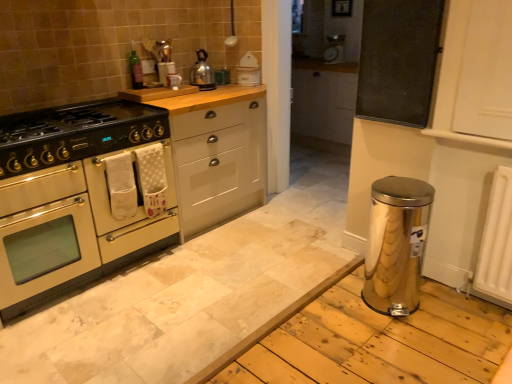
What is the approximate height of polished stainless steel kettle at upper center?

polished stainless steel kettle at upper center is 11.04 inches in height.

What are the coordinates of `white plastic toaster at upper center` in the screenshot? It's located at (248, 70).

I want to click on metallic mesh board at upper right, so click(398, 60).

The height and width of the screenshot is (384, 512). Describe the element at coordinates (214, 150) in the screenshot. I see `white matte cabinet at center, the 2th cabinetry in the left-to-right sequence` at that location.

This screenshot has width=512, height=384. Describe the element at coordinates (396, 244) in the screenshot. I see `stainless steel water heater at lower right` at that location.

Measure the distance between point (x=389, y=203) and camera.

The depth of point (x=389, y=203) is 1.99 meters.

Measure the distance between point (42, 113) and camera.

Point (42, 113) and camera are 8.22 feet apart from each other.

The width and height of the screenshot is (512, 384). What do you see at coordinates (85, 127) in the screenshot?
I see `matte black gas stove at left` at bounding box center [85, 127].

The image size is (512, 384). Find the location of `cream matte oven at left, the 1th cabinetry positioned from the left`. cream matte oven at left, the 1th cabinetry positioned from the left is located at coordinates (120, 184).

Where is `green glass bottle at upper center`? This screenshot has width=512, height=384. green glass bottle at upper center is located at coordinates (136, 70).

Identify the location of polished stainless steel kettle at upper center. This screenshot has width=512, height=384. (202, 73).

How many degrees apart are the facing directions of green glass bottle at upper center and white plastic toaster at upper center?

The facing directions of green glass bottle at upper center and white plastic toaster at upper center are 65.7 degrees apart.

Which object is more forward, green glass bottle at upper center or white plastic toaster at upper center?

Positioned in front is green glass bottle at upper center.

From a real-world perspective, which object stands above the other?

green glass bottle at upper center.

Could you tell me if polished stainless steel kettle at upper center is turned towards stainless steel water heater at lower right?

Yes.

The image size is (512, 384). Identify the location of kitchen appliance positioned vertically above the stainless steel water heater at lower right (from a real-world perspective). (202, 73).

From a real-world perspective, is polished stainless steel kettle at upper center positioned over stainless steel water heater at lower right based on gravity?

Yes, from a real-world perspective, polished stainless steel kettle at upper center is above stainless steel water heater at lower right.

Which object is closer to the camera, polished stainless steel kettle at upper center or stainless steel water heater at lower right?

stainless steel water heater at lower right is closer to the camera.

Could you tell me if metallic mesh board at upper right is facing stainless steel water heater at lower right?

No, metallic mesh board at upper right does not turn towards stainless steel water heater at lower right.

From a real-world perspective, is metallic mesh board at upper right on stainless steel water heater at lower right?

Yes, from a real-world perspective, metallic mesh board at upper right is on top of stainless steel water heater at lower right.

Is metallic mesh board at upper right spatially inside stainless steel water heater at lower right, or outside of it?

metallic mesh board at upper right lies outside stainless steel water heater at lower right.

Are white matte cabinet at center, the 2th cabinetry in the left-to-right sequence, and green glass bottle at upper center far apart?

They are positioned close to each other.

Does white matte cabinet at center, which is counted as the 1th cabinetry, starting from the right, have a greater width compared to green glass bottle at upper center?

Indeed, white matte cabinet at center, which is counted as the 1th cabinetry, starting from the right, has a greater width compared to green glass bottle at upper center.

How different are the orientations of white matte cabinet at center, the 2th cabinetry in the left-to-right sequence, and green glass bottle at upper center in degrees?

The angular difference between white matte cabinet at center, the 2th cabinetry in the left-to-right sequence, and green glass bottle at upper center is 1.85 degrees.

Which object is further away from the camera, white matte cabinet at center, the 2th cabinetry in the left-to-right sequence, or green glass bottle at upper center?

green glass bottle at upper center is more distant.

From the image's perspective, which is below, stainless steel water heater at lower right or cream matte oven at left, the 1th cabinetry positioned from the left?

stainless steel water heater at lower right, from the image's perspective.

Is stainless steel water heater at lower right looking in the opposite direction of cream matte oven at left, the 2th cabinetry positioned from the right?

stainless steel water heater at lower right is not turned away from cream matte oven at left, the 2th cabinetry positioned from the right.

Is stainless steel water heater at lower right placed right next to cream matte oven at left, the 1th cabinetry positioned from the left?

stainless steel water heater at lower right is not next to cream matte oven at left, the 1th cabinetry positioned from the left, and they're not touching.

Which is more to the right, stainless steel water heater at lower right or cream matte oven at left, the 2th cabinetry positioned from the right?

stainless steel water heater at lower right is more to the right.

At what (x,y) coordinates should I click in order to perform the action: click on kitchen appliance located above the green glass bottle at upper center (from the image's perspective). Please return your answer as a coordinate pair (x, y). This screenshot has height=384, width=512. Looking at the image, I should click on (202, 73).

Does point (206, 75) come closer to viewer compared to point (132, 50)?

That is False.

Considering the sizes of objects polished stainless steel kettle at upper center and green glass bottle at upper center in the image provided, who is thinner, polished stainless steel kettle at upper center or green glass bottle at upper center?

green glass bottle at upper center.

Is stainless steel water heater at lower right facing towards polished stainless steel kettle at upper center?

No.

Is the position of stainless steel water heater at lower right less distant than that of polished stainless steel kettle at upper center?

Yes, it is in front of polished stainless steel kettle at upper center.

From the picture: From the image's perspective, would you say stainless steel water heater at lower right is shown under polished stainless steel kettle at upper center?

Yes, from the image's perspective, stainless steel water heater at lower right is below polished stainless steel kettle at upper center.

Would you say stainless steel water heater at lower right is outside polished stainless steel kettle at upper center?

That's correct, stainless steel water heater at lower right is outside of polished stainless steel kettle at upper center.

At what (x,y) coordinates should I click in order to perform the action: click on bottle in front of the white plastic toaster at upper center. Please return your answer as a coordinate pair (x, y). The image size is (512, 384). Looking at the image, I should click on (136, 70).

Locate an element on the screen. kitchen appliance located above the stainless steel water heater at lower right (from a real-world perspective) is located at coordinates (202, 73).

Which object lies further to the anchor point white plastic toaster at upper center, green glass bottle at upper center or polished stainless steel kettle at upper center?

green glass bottle at upper center lies further to white plastic toaster at upper center than the other object.

Looking at the image, which one is located further to matte black gas stove at left, metallic mesh board at upper right or green glass bottle at upper center?

metallic mesh board at upper right is positioned further to the anchor matte black gas stove at left.

Which object lies further to the anchor point white plastic toaster at upper center, green glass bottle at upper center or cream matte oven at left, the 2th cabinetry positioned from the right?

cream matte oven at left, the 2th cabinetry positioned from the right, is further to white plastic toaster at upper center.

Considering their positions, is matte black gas stove at left positioned closer to stainless steel water heater at lower right than green glass bottle at upper center?

matte black gas stove at left.

Which object lies further to the anchor point stainless steel water heater at lower right, metallic mesh board at upper right or white plastic toaster at upper center?

The object further to stainless steel water heater at lower right is white plastic toaster at upper center.

Considering their positions, is matte black gas stove at left positioned further to cream matte oven at left, the 2th cabinetry positioned from the right, than white matte cabinet at center, which is counted as the 1th cabinetry, starting from the right?

The object further to cream matte oven at left, the 2th cabinetry positioned from the right, is matte black gas stove at left.

Considering their positions, is metallic mesh board at upper right positioned closer to matte black gas stove at left than cream matte oven at left, the 2th cabinetry positioned from the right?

Based on the image, cream matte oven at left, the 2th cabinetry positioned from the right, appears to be nearer to matte black gas stove at left.

Based on the photo, from the image, which object appears to be nearer to polished stainless steel kettle at upper center, green glass bottle at upper center or white matte cabinet at center, which is counted as the 1th cabinetry, starting from the right?

→ The object closer to polished stainless steel kettle at upper center is green glass bottle at upper center.

Locate an element on the screen. The width and height of the screenshot is (512, 384). kitchen appliance between white plastic toaster at upper center and white matte cabinet at center, the 2th cabinetry in the left-to-right sequence, vertically is located at coordinates (202, 73).

What are the coordinates of `cabinetry between cream matte oven at left, the 2th cabinetry positioned from the right, and green glass bottle at upper center in the front-back direction` in the screenshot? It's located at (214, 150).

Where is `cabinetry located between cream matte oven at left, the 2th cabinetry positioned from the right, and stainless steel water heater at lower right in the left-right direction`? This screenshot has width=512, height=384. cabinetry located between cream matte oven at left, the 2th cabinetry positioned from the right, and stainless steel water heater at lower right in the left-right direction is located at coordinates (214, 150).

Find the location of a particular element. bottle located between matte black gas stove at left and white plastic toaster at upper center in the depth direction is located at coordinates coord(136,70).